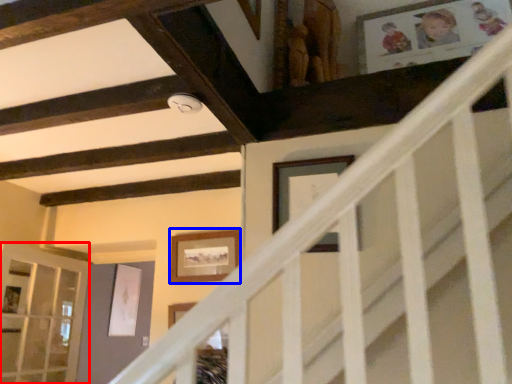
Question: Which point is further to the camera, glass door (highlighted by a red box) or picture frame (highlighted by a blue box)?

Choices:
 (A) glass door
 (B) picture frame

Answer: (B)